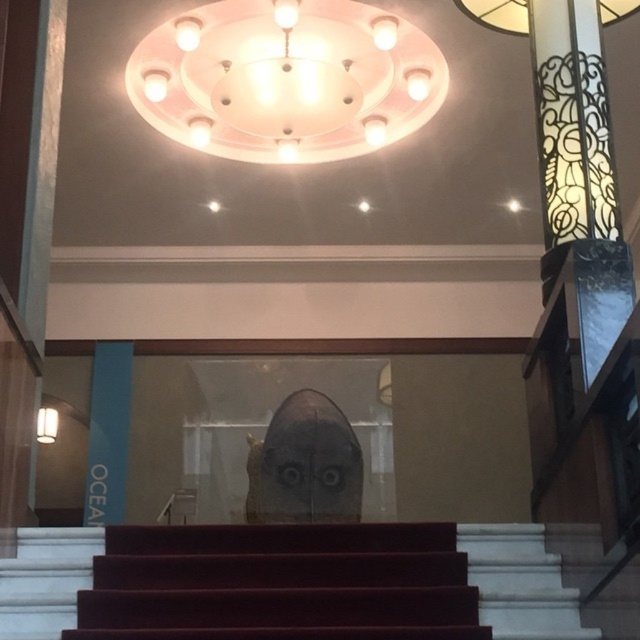
Who is shorter, maroon carpeted stairs at center or matte white chandelier at upper center?

With less height is maroon carpeted stairs at center.

Image resolution: width=640 pixels, height=640 pixels. I want to click on maroon carpeted stairs at center, so click(x=280, y=582).

Consider the image. Can you confirm if maroon carpeted stairs at center is positioned to the left of white marble stairs at center?

Yes, maroon carpeted stairs at center is to the left of white marble stairs at center.

From the picture: Does maroon carpeted stairs at center have a larger size compared to white marble stairs at center?

Correct, maroon carpeted stairs at center is larger in size than white marble stairs at center.

The height and width of the screenshot is (640, 640). What do you see at coordinates (280, 582) in the screenshot?
I see `maroon carpeted stairs at center` at bounding box center [280, 582].

At what (x,y) coordinates should I click in order to perform the action: click on maroon carpeted stairs at center. Please return your answer as a coordinate pair (x, y). Looking at the image, I should click on (280, 582).

Does matte white chandelier at upper center have a lesser width compared to white marble stairs at center?

Incorrect, matte white chandelier at upper center's width is not less than white marble stairs at center's.

Between matte white chandelier at upper center and white marble stairs at center, which one is positioned lower?

white marble stairs at center is below.

You are a GUI agent. You are given a task and a screenshot of the screen. Output one action in this format:
    pyautogui.click(x=<x>, y=<y>)
    Task: Click on the matte white chandelier at upper center
    This screenshot has height=640, width=640.
    Given the screenshot: What is the action you would take?
    pyautogui.click(x=285, y=80)

Locate an element on the screen. matte white chandelier at upper center is located at coordinates (285, 80).